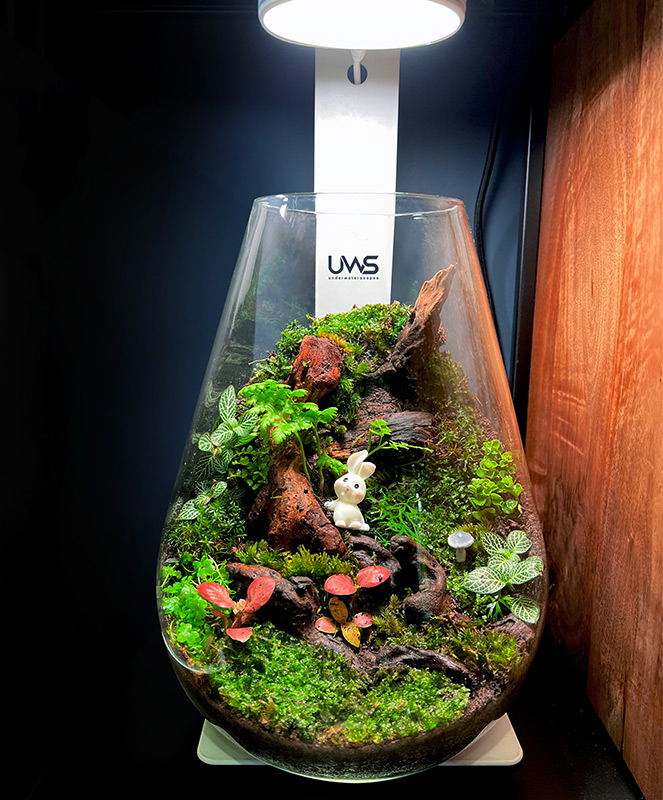
The width and height of the screenshot is (663, 800). Identify the location of plant light. (386, 13).